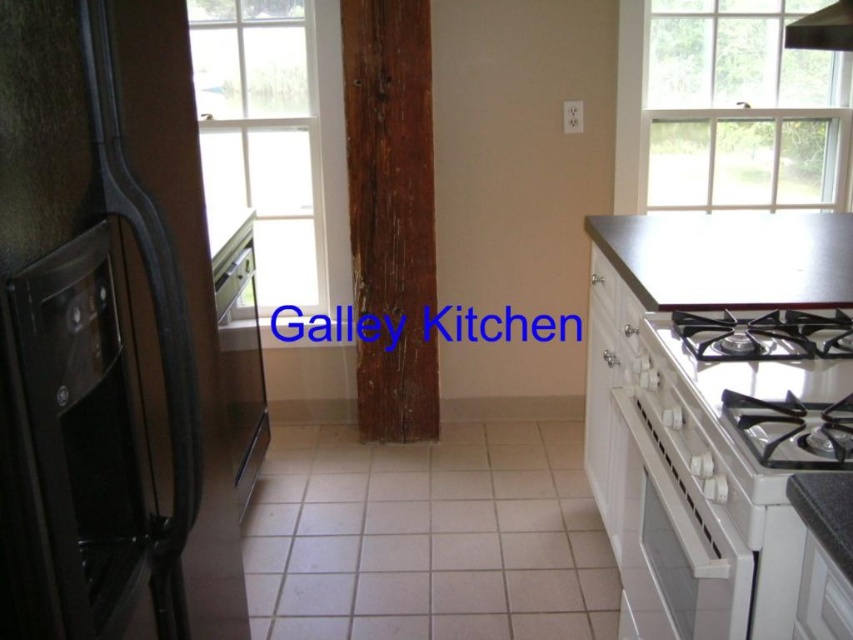
You are a chef preparing a meal and need to place a large cutting board on the counter. Given that the metallic gray countertop at upper right and the smooth gray countertop at right are both available, which one can accommodate the board due to its greater width?

The metallic gray countertop at upper right can accommodate the large cutting board because its width surpasses that of the smooth gray countertop at right.

Based on the photo, you are standing in the galley kitchen and want to place a small bowl at point (825, 512). Is that point on the smooth gray countertop at right?

Yes, the point (825, 512) is on the smooth gray countertop at right, so placing the bowl there is possible.

In the scene shown: You are standing in the galley kitchen and want to check the oven status through the clear glass window at upper center. Considering the oven is at eye level, can you reach the window to look inside without moving closer than 8 feet?

The clear glass window at upper center is 8.75 feet away from viewer. Since the oven is at eye level and you need to be within 8.75 feet to reach it, you can comfortably check the oven status without needing to move closer than 8 feet.